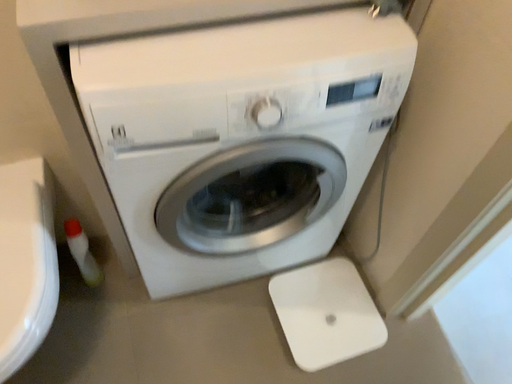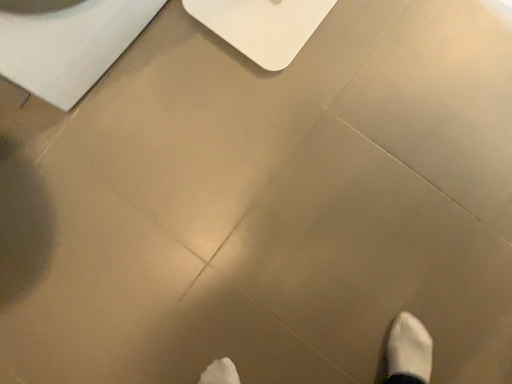
Question: Which way did the camera rotate in the video?

Choices:
 (A) rotated left
 (B) rotated right

Answer: (B)